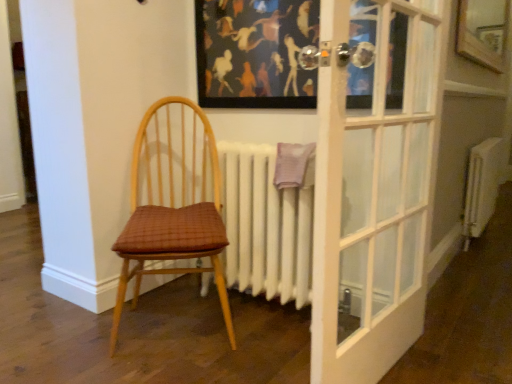
Locate an element on the screen. vacant space in front of white matte radiator at center, which ranks as the 1th radiator in front-to-back order is located at coordinates (258, 349).